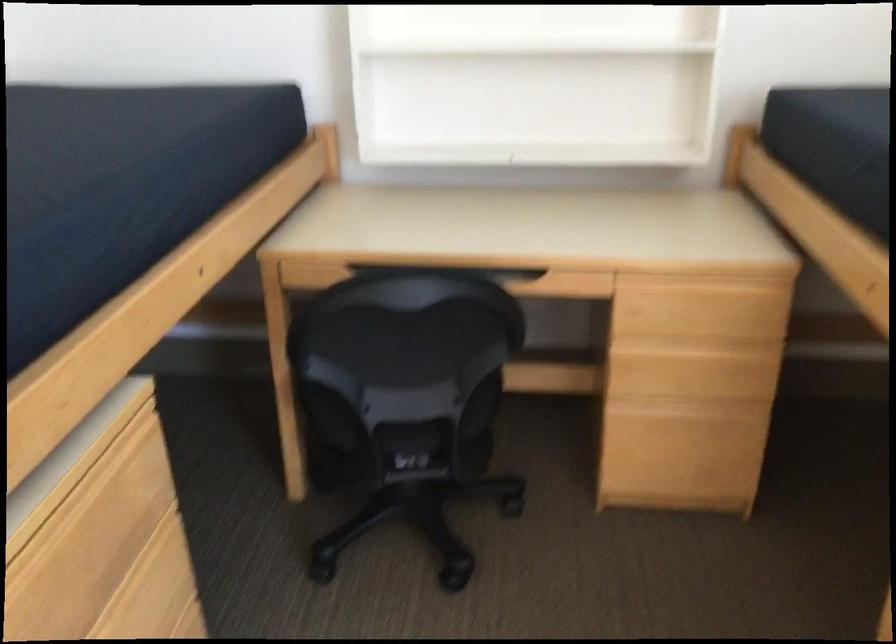
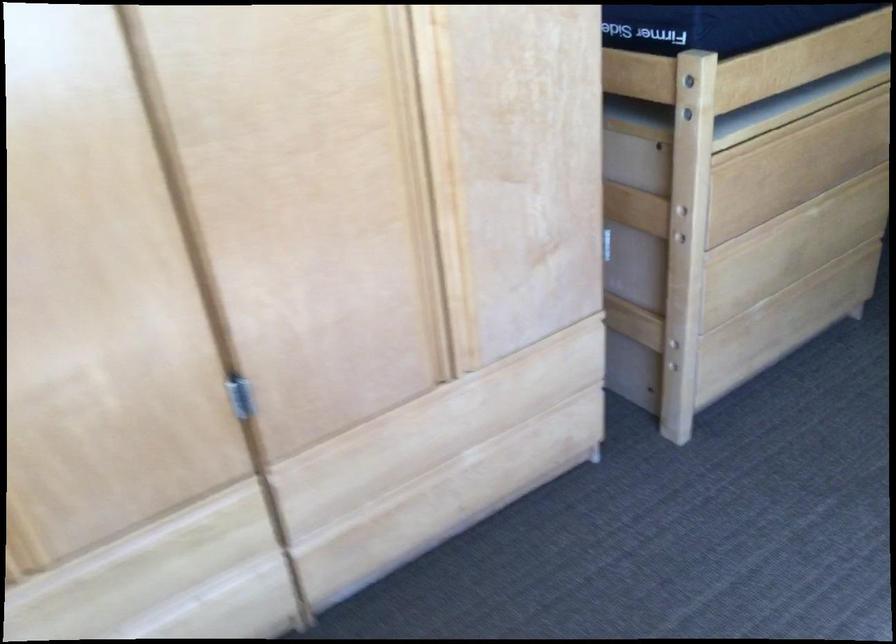
Question: The camera is either moving clockwise (left) or counter-clockwise (right) around the object. The first image is from the beginning of the video and the second image is from the end. Is the camera moving left or right when shooting the video?

Choices:
 (A) Left
 (B) Right

Answer: (B)